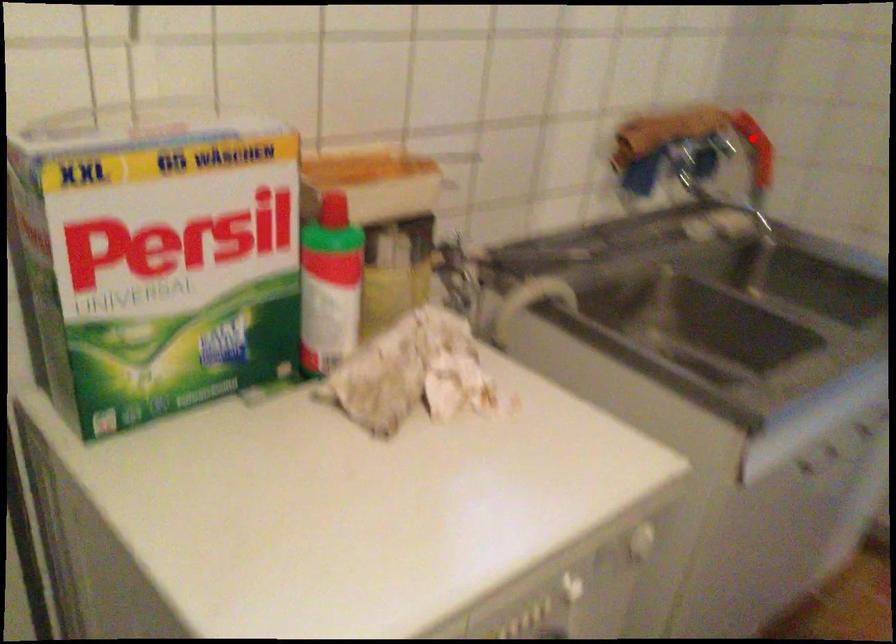
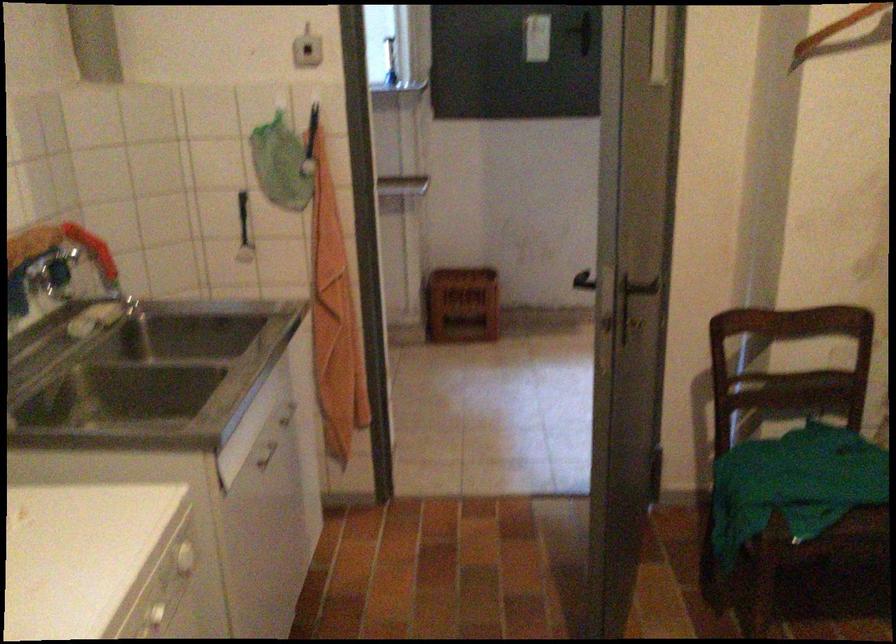
Where in the second image is the point corresponding to the highlighted location from the first image?

(91, 249)